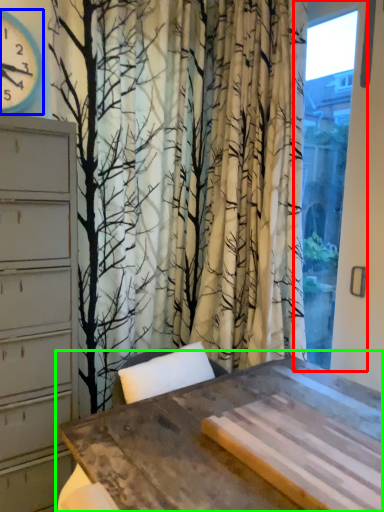
Question: Estimate the real-world distances between objects in this image. Which object is closer to window (highlighted by a red box), clock (highlighted by a blue box) or table (highlighted by a green box)?

Choices:
 (A) clock
 (B) table

Answer: (B)